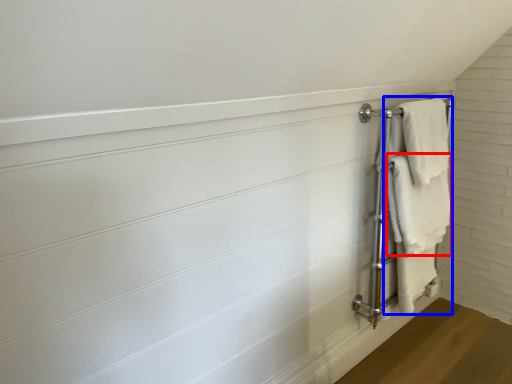
Question: Which point is closer to the camera, towel (highlighted by a red box) or bath towel (highlighted by a blue box)?

Choices:
 (A) towel
 (B) bath towel

Answer: (B)